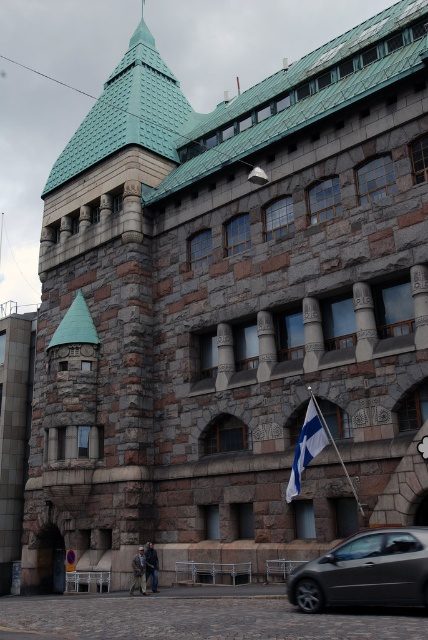
Which is more to the left, metallic gray car at lower right or white fabric flag at center?

white fabric flag at center is more to the left.

Can you confirm if metallic gray car at lower right is positioned below white fabric flag at center?

Correct, metallic gray car at lower right is located below white fabric flag at center.

Does point (342, 545) lie in front of point (297, 481)?

Yes, it is.

This screenshot has width=428, height=640. In order to click on metallic gray car at lower right in this screenshot , I will do `click(365, 572)`.